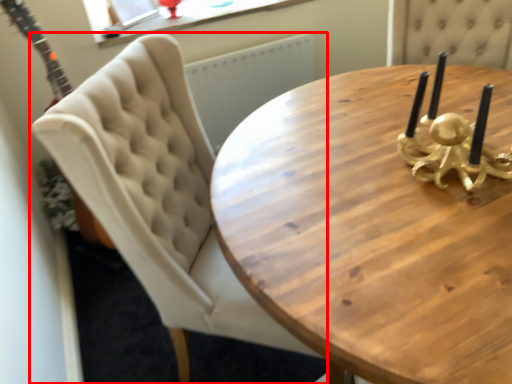
Question: From the image's perspective, what is the correct spatial relationship of chair (annotated by the red box) in relation to coffee table?

Choices:
 (A) below
 (B) above

Answer: (B)